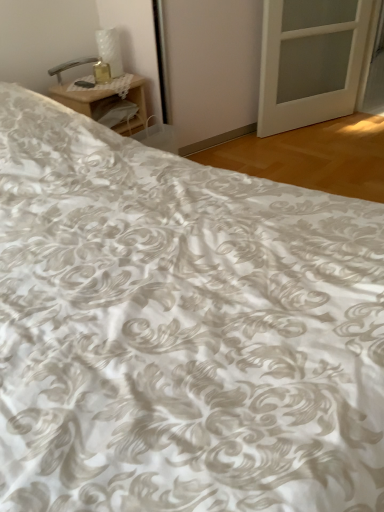
Question: Should I look upward or downward to see woodennightstand at upper left?

Choices:
 (A) down
 (B) up

Answer: (B)

Question: Considering the relative sizes of metallic silver table lamp at upper left and woodennightstand at upper left in the image provided, is metallic silver table lamp at upper left bigger than woodennightstand at upper left?

Choices:
 (A) yes
 (B) no

Answer: (B)

Question: Is metallic silver table lamp at upper left surrounding woodennightstand at upper left?

Choices:
 (A) yes
 (B) no

Answer: (B)

Question: From the image's perspective, does metallic silver table lamp at upper left appear lower than woodennightstand at upper left?

Choices:
 (A) no
 (B) yes

Answer: (A)

Question: Is metallic silver table lamp at upper left completely or partially outside of woodennightstand at upper left?

Choices:
 (A) yes
 (B) no

Answer: (A)

Question: Is metallic silver table lamp at upper left positioned with its back to woodennightstand at upper left?

Choices:
 (A) no
 (B) yes

Answer: (A)

Question: Does metallic silver table lamp at upper left appear on the right side of woodennightstand at upper left?

Choices:
 (A) no
 (B) yes

Answer: (A)

Question: Is woodennightstand at upper left in front of metallic silver table lamp at upper left?

Choices:
 (A) no
 (B) yes

Answer: (B)

Question: Is woodennightstand at upper left to the left of metallic silver table lamp at upper left from the viewer's perspective?

Choices:
 (A) no
 (B) yes

Answer: (A)

Question: Can you confirm if woodennightstand at upper left is smaller than metallic silver table lamp at upper left?

Choices:
 (A) yes
 (B) no

Answer: (B)

Question: Considering the relative sizes of woodennightstand at upper left and metallic silver table lamp at upper left in the image provided, is woodennightstand at upper left thinner than metallic silver table lamp at upper left?

Choices:
 (A) no
 (B) yes

Answer: (A)

Question: Can you confirm if woodennightstand at upper left is bigger than metallic silver table lamp at upper left?

Choices:
 (A) no
 (B) yes

Answer: (B)

Question: Is woodennightstand at upper left facing away from metallic silver table lamp at upper left?

Choices:
 (A) no
 (B) yes

Answer: (A)

Question: From the image's perspective, is woodennightstand at upper left positioned above or below metallic silver table lamp at upper left?

Choices:
 (A) below
 (B) above

Answer: (A)